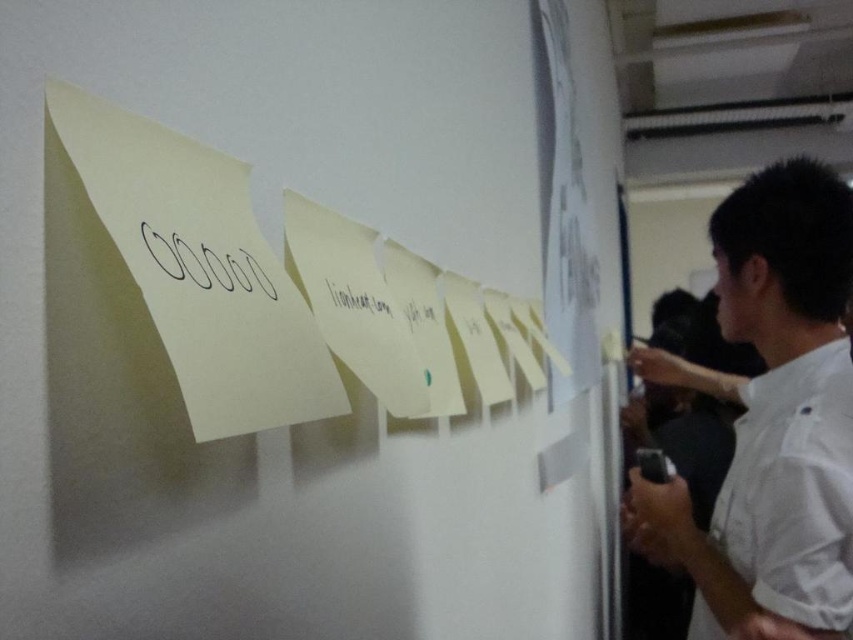
Can you confirm if white shirt at right is positioned above black paper at center?

Actually, white shirt at right is below black paper at center.

Consider the image. Who is more forward, (819, 278) or (364, 305)?

Point (364, 305)

Identify the location of white shirt at right. The height and width of the screenshot is (640, 853). (769, 416).

Between point (13, 428) and point (376, 304), which one is positioned in front?

Positioned in front is point (13, 428).

Consider the image. Is yellow paper notes at upper center further to camera compared to black paper at center?

No, yellow paper notes at upper center is in front of black paper at center.

Find the location of a particular element. The image size is (853, 640). yellow paper notes at upper center is located at coordinates (280, 243).

Does black ink circles at upper center have a lesser height compared to black paper at center?

Incorrect, black ink circles at upper center's height does not fall short of black paper at center's.

What do you see at coordinates (206, 262) in the screenshot? Image resolution: width=853 pixels, height=640 pixels. I see `black ink circles at upper center` at bounding box center [206, 262].

Does point (186, 275) lie behind point (387, 314)?

No, it is in front of (387, 314).

Find the location of `black ink circles at upper center`. black ink circles at upper center is located at coordinates (206, 262).